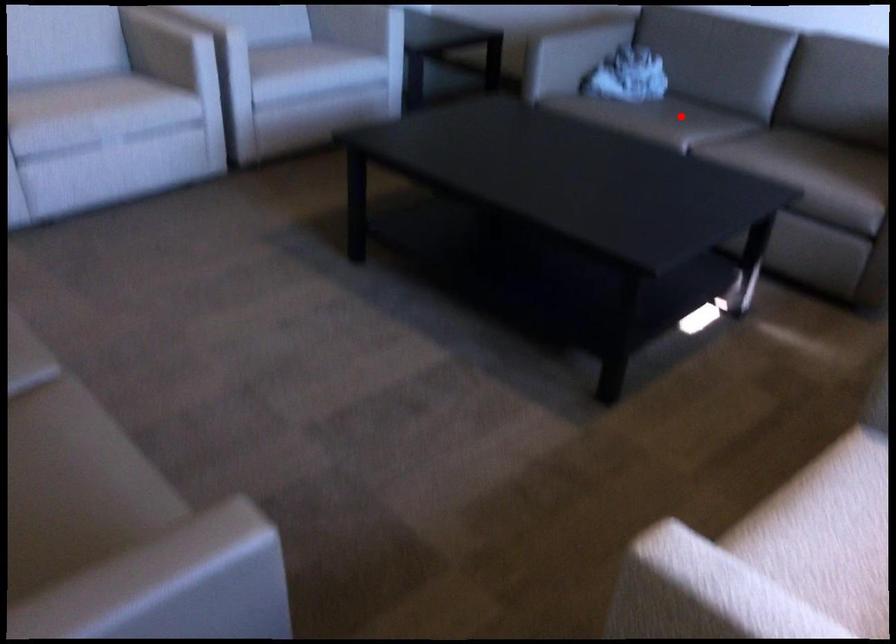
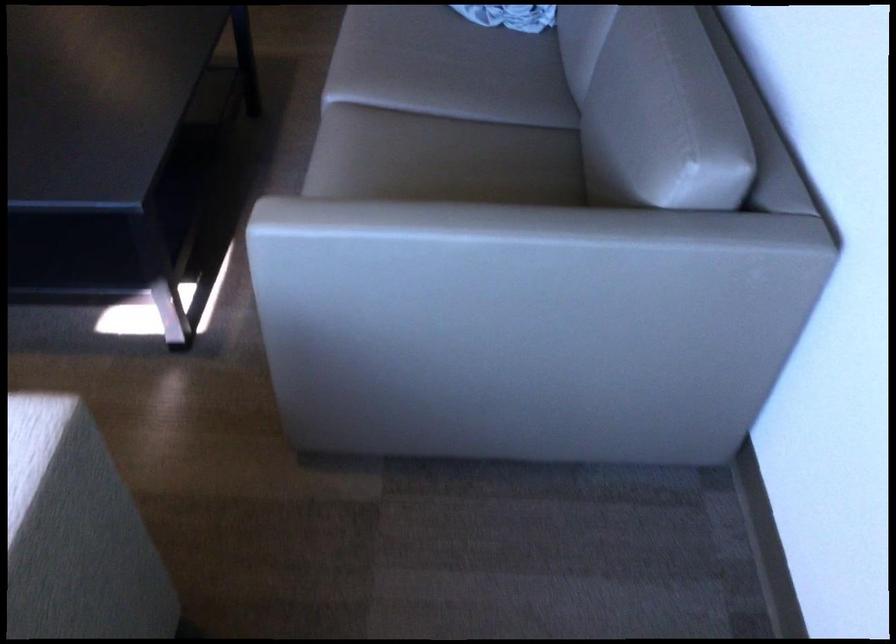
The point at the highlighted location is marked in the first image. Where is the corresponding point in the second image?

(463, 73)